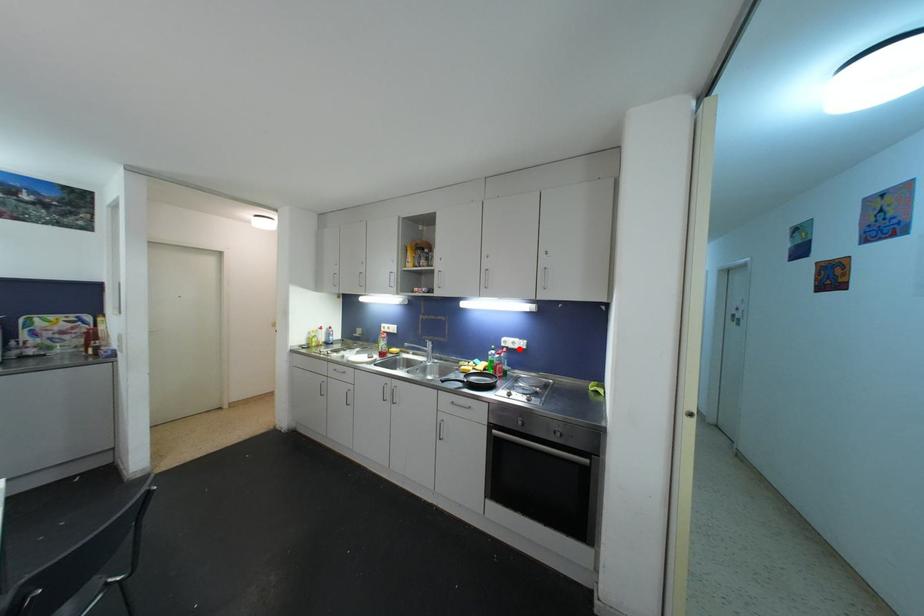
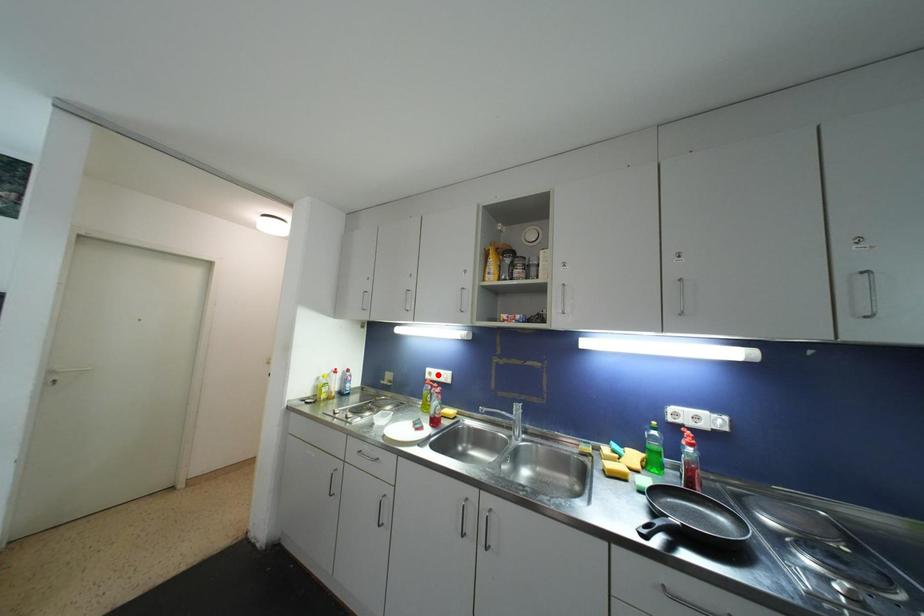
I am providing you with two images of the same scene from different viewpoints. A red point is marked on the first image and another point is marked on the second image. Does the point marked in image1 correspond to the same location as the one in image2?

No